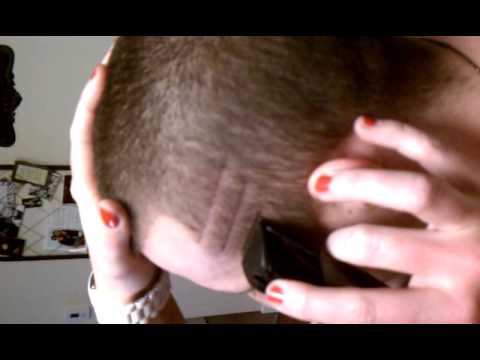
Find the location of `board`. board is located at coordinates pos(51,205).